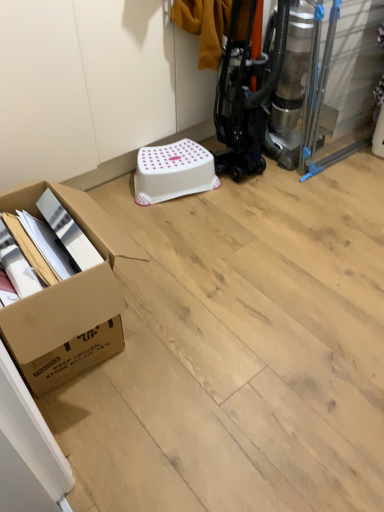
Question: Is point (195, 151) closer or farther from the camera than point (115, 337)?

Choices:
 (A) closer
 (B) farther

Answer: (B)

Question: Do you think white plastic stool at center is within brown cardboard box at lower left, or outside of it?

Choices:
 (A) outside
 (B) inside

Answer: (A)

Question: Visually, is white plastic stool at center positioned to the left or to the right of brown cardboard box at lower left?

Choices:
 (A) right
 (B) left

Answer: (A)

Question: From the image's perspective, is brown cardboard box at lower left above or below white plastic stool at center?

Choices:
 (A) below
 (B) above

Answer: (A)

Question: From a real-world perspective, is brown cardboard box at lower left positioned above or below white plastic stool at center?

Choices:
 (A) above
 (B) below

Answer: (A)

Question: Which is correct: brown cardboard box at lower left is inside white plastic stool at center, or outside of it?

Choices:
 (A) outside
 (B) inside

Answer: (A)

Question: Considering the positions of brown cardboard box at lower left and white plastic stool at center in the image, is brown cardboard box at lower left wider or thinner than white plastic stool at center?

Choices:
 (A) wide
 (B) thin

Answer: (A)